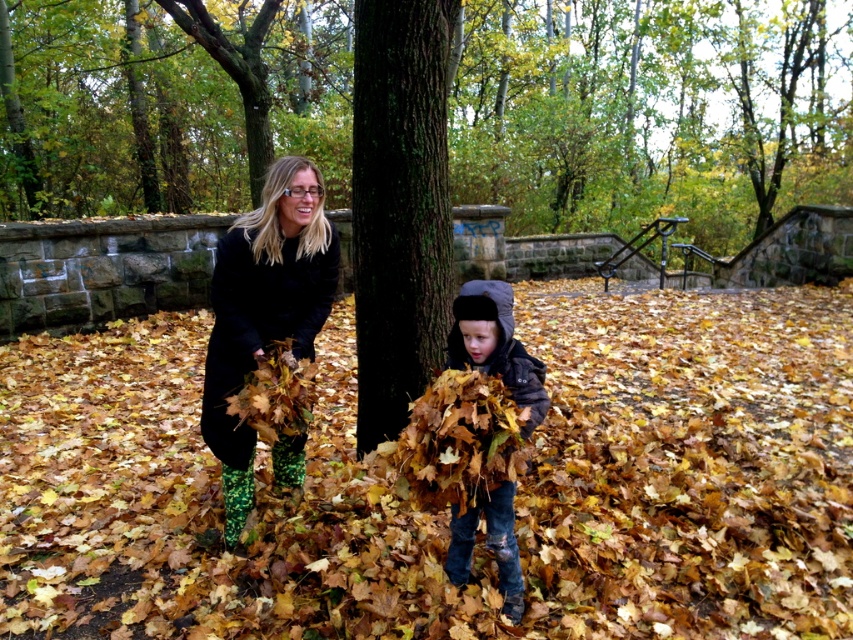
Is dark green textured bark at center to the right of matte black coat at center from the viewer's perspective?

Yes, dark green textured bark at center is to the right of matte black coat at center.

Can you confirm if dark green textured bark at center is positioned above matte black coat at center?

Yes, dark green textured bark at center is above matte black coat at center.

In the scene shown: Measure the distance between dark green textured bark at center and camera.

The distance of dark green textured bark at center from camera is 3.14 meters.

I want to click on dark green textured bark at center, so [399, 205].

Based on the photo, between green rough bark tree at center and brown fuzzy coat at center, which one has less height?

brown fuzzy coat at center is shorter.

Is green rough bark tree at center in front of brown fuzzy coat at center?

No, green rough bark tree at center is behind brown fuzzy coat at center.

Which is in front, point (660, 156) or point (500, 348)?

Point (500, 348)

This screenshot has width=853, height=640. I want to click on green rough bark tree at center, so click(x=653, y=112).

Image resolution: width=853 pixels, height=640 pixels. What do you see at coordinates (653, 112) in the screenshot? I see `green rough bark tree at center` at bounding box center [653, 112].

Measure the distance between green rough bark tree at center and dark green textured bark at center.

A distance of 51.90 feet exists between green rough bark tree at center and dark green textured bark at center.

Between point (18, 45) and point (439, 337), which one is positioned behind?

The point (18, 45) is behind.

Identify the location of green rough bark tree at center. (653, 112).